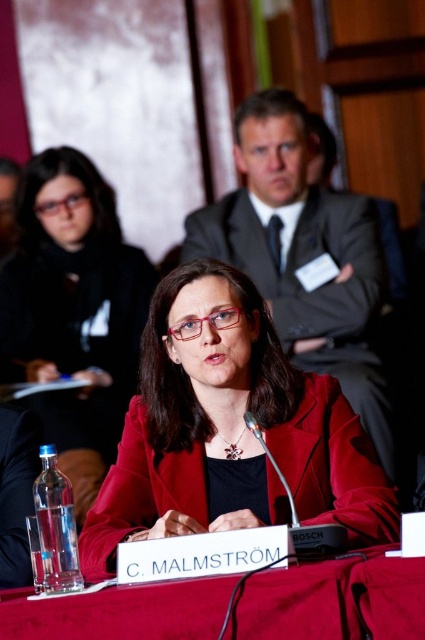
Between point (328, 474) and point (88, 598), which one is positioned in front?

Positioned in front is point (88, 598).

Locate an element on the screen. Image resolution: width=425 pixels, height=640 pixels. matte red jacket at center is located at coordinates (229, 429).

Is matte gray suit at center thinner than smooth red table at center?

No.

The image size is (425, 640). Describe the element at coordinates (302, 253) in the screenshot. I see `matte gray suit at center` at that location.

Identify the location of matte gray suit at center. (302, 253).

The height and width of the screenshot is (640, 425). I want to click on matte gray suit at center, so click(x=302, y=253).

The width and height of the screenshot is (425, 640). Describe the element at coordinates (302, 253) in the screenshot. I see `matte gray suit at center` at that location.

Who is taller, matte gray suit at center or matte black jacket at center?

matte gray suit at center is taller.

Is point (357, 412) in front of point (22, 232)?

Yes, it is in front of point (22, 232).

Image resolution: width=425 pixels, height=640 pixels. What are the coordinates of `matte gray suit at center` in the screenshot? It's located at (302, 253).